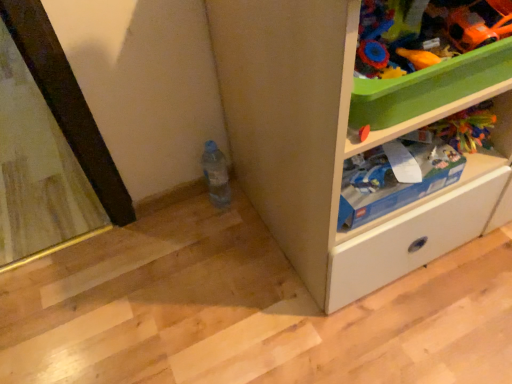
Find the location of a particular element. vacant point to the left of orange matte car at upper right, which appears as the first toy when viewed from the right is located at coordinates coord(419,46).